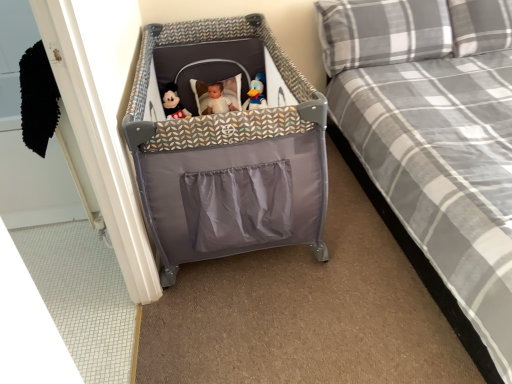
Identify the location of gray plaid pillow at upper right, which is the second pillow in right-to-left order. Image resolution: width=512 pixels, height=384 pixels. (382, 32).

Measure the distance between plaid fabric bed at center and camera.

A distance of 3.60 feet exists between plaid fabric bed at center and camera.

The width and height of the screenshot is (512, 384). What do you see at coordinates (256, 94) in the screenshot?
I see `blue plush duck at center` at bounding box center [256, 94].

Locate an element on the screen. This screenshot has height=384, width=512. matte plush mickey mouse at center is located at coordinates (173, 103).

Can you confirm if gray plaid pillow at upper right, the second pillow from the left, is wider than gray plaid pillow at upper right, which is the second pillow in right-to-left order?

No.

What's the angular difference between gray plaid pillow at upper right, the second pillow from the left, and gray plaid pillow at upper right, marked as the first pillow in a left-to-right arrangement,'s facing directions?

gray plaid pillow at upper right, the second pillow from the left, and gray plaid pillow at upper right, marked as the first pillow in a left-to-right arrangement, are facing 1.68 degrees away from each other.

Considering the points (507, 19) and (410, 12), which point is in front, point (507, 19) or point (410, 12)?

The point (410, 12) is more forward.

Which of these two, gray plaid pillow at upper right, the first pillow from the right, or gray plaid pillow at upper right, which is the second pillow in right-to-left order, stands shorter?

gray plaid pillow at upper right, the first pillow from the right, is shorter.

Considering the relative positions of gray plaid pillow at upper right, which is the second pillow in right-to-left order, and matte plush mickey mouse at center in the image provided, is gray plaid pillow at upper right, which is the second pillow in right-to-left order, in front of matte plush mickey mouse at center?

Yes, it is.

Are gray plaid pillow at upper right, marked as the first pillow in a left-to-right arrangement, and matte plush mickey mouse at center far apart?

Absolutely, gray plaid pillow at upper right, marked as the first pillow in a left-to-right arrangement, is distant from matte plush mickey mouse at center.

From the image's perspective, which one is positioned lower, gray plaid pillow at upper right, marked as the first pillow in a left-to-right arrangement, or matte plush mickey mouse at center?

matte plush mickey mouse at center.

Measure the distance from gray plaid pillow at upper right, marked as the first pillow in a left-to-right arrangement, to matte plush mickey mouse at center.

gray plaid pillow at upper right, marked as the first pillow in a left-to-right arrangement, is 1.11 meters away from matte plush mickey mouse at center.

Consider the image. Considering the positions of objects matte plush mickey mouse at center and plaid fabric bed at center in the image provided, who is behind, matte plush mickey mouse at center or plaid fabric bed at center?

matte plush mickey mouse at center is further from the camera.

Between point (167, 110) and point (475, 250), which one is positioned in front?

The point (475, 250) is in front.

Measure the distance from matte plush mickey mouse at center to plaid fabric bed at center.

matte plush mickey mouse at center and plaid fabric bed at center are 1.21 meters apart.

This screenshot has height=384, width=512. Find the location of `doll located above the plaid fabric bed at center (from the image's perspective)`. doll located above the plaid fabric bed at center (from the image's perspective) is located at coordinates (173, 103).

From the picture: From a real-world perspective, between matte plush mickey mouse at center and blue plush duck at center, who is vertically lower?

In real-world perspective, matte plush mickey mouse at center is lower.

Considering the relative sizes of matte plush mickey mouse at center and blue plush duck at center in the image provided, is matte plush mickey mouse at center shorter than blue plush duck at center?

No, matte plush mickey mouse at center is not shorter than blue plush duck at center.

Is matte plush mickey mouse at center not near blue plush duck at center?

Actually, matte plush mickey mouse at center and blue plush duck at center are a little close together.

Between point (490, 234) and point (434, 25), which one is positioned in front?

The point (490, 234) is in front.

How many degrees apart are the facing directions of plaid fabric bed at center and gray plaid pillow at upper right, which is the second pillow in right-to-left order?

They differ by 2.48 degrees in their facing directions.

Could you tell me if plaid fabric bed at center is facing gray plaid pillow at upper right, marked as the first pillow in a left-to-right arrangement?

No, plaid fabric bed at center does not turn towards gray plaid pillow at upper right, marked as the first pillow in a left-to-right arrangement.

Considering the sizes of objects blue plush duck at center and plaid fabric bed at center in the image provided, who is smaller, blue plush duck at center or plaid fabric bed at center?

Smaller between the two is blue plush duck at center.

Is blue plush duck at center wider than plaid fabric bed at center?

No.

How many degrees apart are the facing directions of blue plush duck at center and plaid fabric bed at center?

There is a 0.573-degree angle between the facing directions of blue plush duck at center and plaid fabric bed at center.

Do you think gray plaid pillow at upper right, marked as the first pillow in a left-to-right arrangement, is within gray plaid pillow at upper right, the second pillow from the left, or outside of it?

gray plaid pillow at upper right, marked as the first pillow in a left-to-right arrangement, is spatially situated outside gray plaid pillow at upper right, the second pillow from the left.

Is gray plaid pillow at upper right, marked as the first pillow in a left-to-right arrangement, placed right next to gray plaid pillow at upper right, the second pillow from the left?

gray plaid pillow at upper right, marked as the first pillow in a left-to-right arrangement, and gray plaid pillow at upper right, the second pillow from the left, are not in contact.

Looking at the image, does gray plaid pillow at upper right, marked as the first pillow in a left-to-right arrangement, seem bigger or smaller compared to gray plaid pillow at upper right, the first pillow from the right?

gray plaid pillow at upper right, marked as the first pillow in a left-to-right arrangement, is bigger than gray plaid pillow at upper right, the first pillow from the right.

At what (x,y) coordinates should I click in order to perform the action: click on pillow below the gray plaid pillow at upper right, the second pillow from the left (from the image's perspective). Please return your answer as a coordinate pair (x, y). The height and width of the screenshot is (384, 512). Looking at the image, I should click on (382, 32).

At what (x,y) coordinates should I click in order to perform the action: click on the 1st pillow to the right when counting from the matte plush mickey mouse at center. Please return your answer as a coordinate pair (x, y). The width and height of the screenshot is (512, 384). Looking at the image, I should click on (382, 32).

From the image, which object appears to be nearer to gray plaid pillow at upper right, the first pillow from the right, plaid fabric bed at center or matte plush mickey mouse at center?

plaid fabric bed at center.

Based on their spatial positions, is matte plush mickey mouse at center or gray plaid pillow at upper right, the first pillow from the right, closer to plaid fabric bed at center?

Among the two, gray plaid pillow at upper right, the first pillow from the right, is located nearer to plaid fabric bed at center.

Which object lies nearer to the anchor point plaid fabric bed at center, matte plush mickey mouse at center or blue plush duck at center?

blue plush duck at center.

Considering their positions, is gray plaid pillow at upper right, which is the second pillow in right-to-left order, positioned further to gray plaid pillow at upper right, the first pillow from the right, than plaid fabric bed at center?

plaid fabric bed at center.

Based on their spatial positions, is matte plush mickey mouse at center or gray plaid pillow at upper right, which is the second pillow in right-to-left order, further from gray plaid pillow at upper right, the first pillow from the right?

Among the two, matte plush mickey mouse at center is located further to gray plaid pillow at upper right, the first pillow from the right.

Considering their positions, is blue plush duck at center positioned closer to gray plaid pillow at upper right, the first pillow from the right, than plaid fabric bed at center?

Based on the image, plaid fabric bed at center appears to be nearer to gray plaid pillow at upper right, the first pillow from the right.

Estimate the real-world distances between objects in this image. Which object is further from matte plush mickey mouse at center, gray plaid pillow at upper right, which is the second pillow in right-to-left order, or plaid fabric bed at center?

The object further to matte plush mickey mouse at center is plaid fabric bed at center.

Considering their positions, is gray plaid pillow at upper right, marked as the first pillow in a left-to-right arrangement, positioned further to matte plush mickey mouse at center than gray plaid pillow at upper right, the first pillow from the right?

gray plaid pillow at upper right, the first pillow from the right.

Identify the location of bed between matte plush mickey mouse at center and gray plaid pillow at upper right, the second pillow from the left. [432, 144].

Find the location of `toy between matte plush mickey mouse at center and gray plaid pillow at upper right, marked as the first pillow in a left-to-right arrangement, from left to right`. toy between matte plush mickey mouse at center and gray plaid pillow at upper right, marked as the first pillow in a left-to-right arrangement, from left to right is located at coordinates (256, 94).

Where is `toy located between matte plush mickey mouse at center and gray plaid pillow at upper right, the second pillow from the left, in the left-right direction`? This screenshot has height=384, width=512. toy located between matte plush mickey mouse at center and gray plaid pillow at upper right, the second pillow from the left, in the left-right direction is located at coordinates (256, 94).

Locate an element on the screen. The height and width of the screenshot is (384, 512). pillow between plaid fabric bed at center and gray plaid pillow at upper right, the first pillow from the right, from front to back is located at coordinates (382, 32).